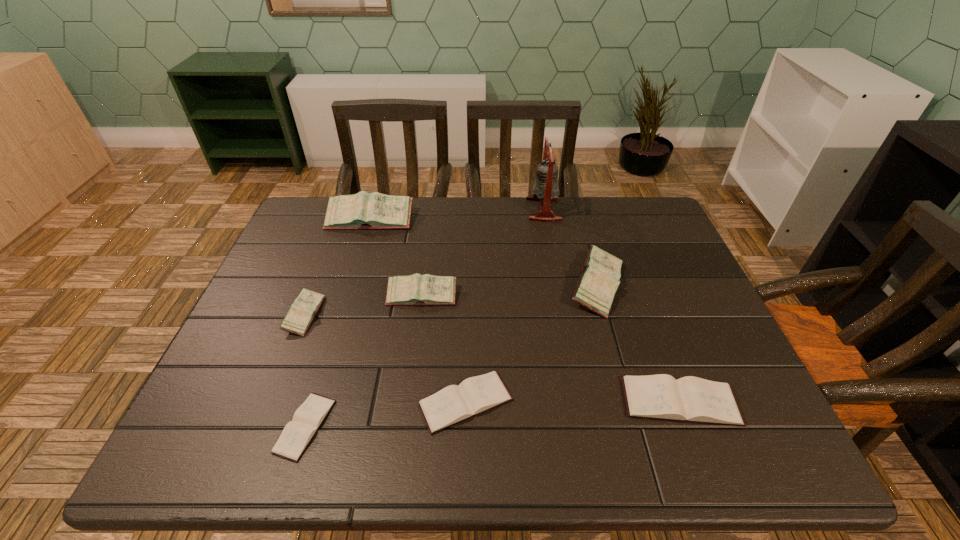
The width and height of the screenshot is (960, 540). I want to click on bell, so click(545, 189).

This screenshot has width=960, height=540. Find the location of `the farthest pink diary`. the farthest pink diary is located at coordinates (364, 210).

You are a GUI agent. You are given a task and a screenshot of the screen. Output one action in this format:
    pyautogui.click(x=<x>, y=<y>)
    Task: Click on the biggest pink diary
    The image size is (960, 540).
    Given the screenshot: What is the action you would take?
    pyautogui.click(x=364, y=210)

Locate an element on the screen. The image size is (960, 540). the sixth shortest diary is located at coordinates (598, 282).

At what (x,y) coordinates should I click in order to perform the action: click on the third tallest object. Please return your answer as a coordinate pair (x, y). This screenshot has height=540, width=960. Looking at the image, I should click on (598, 282).

Where is `the fourth tallest object`? the fourth tallest object is located at coordinates (416, 289).

At what (x,y) coordinates should I click in order to perform the action: click on the second smallest pink diary. Please return your answer as a coordinate pair (x, y). The width and height of the screenshot is (960, 540). Looking at the image, I should click on (416, 289).

The image size is (960, 540). Identify the location of the fourth shortest object. (302, 312).

Image resolution: width=960 pixels, height=540 pixels. What are the coordinates of `the fourth shortest diary` in the screenshot? It's located at (302, 312).

Locate an element on the screen. The height and width of the screenshot is (540, 960). the fifth tallest diary is located at coordinates (688, 399).